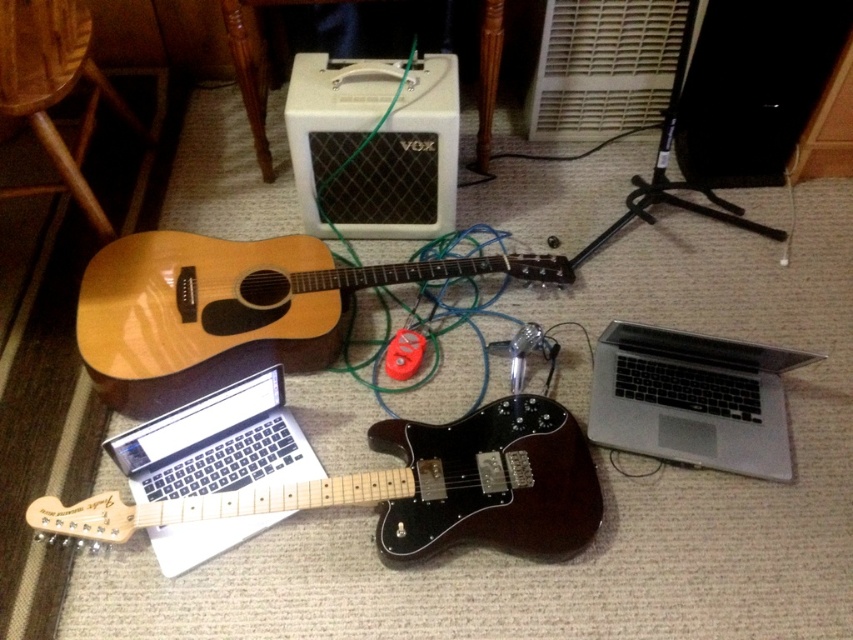
Question: Can you confirm if white mesh vox amplifier at center is positioned above silver metallic laptop at lower left?

Choices:
 (A) yes
 (B) no

Answer: (A)

Question: Does glossy wood guitar at center have a larger size compared to silver metallic laptop at lower right?

Choices:
 (A) no
 (B) yes

Answer: (B)

Question: Which of the following is the farthest from the observer?

Choices:
 (A) natural wood acoustic guitar at center
 (B) wooden stool at lower left
 (C) white mesh vox amplifier at center
 (D) silver metallic laptop at lower right

Answer: (C)

Question: Which point is closer to the camera?

Choices:
 (A) white mesh vox amplifier at center
 (B) natural wood acoustic guitar at center

Answer: (B)

Question: Can you confirm if glossy wood guitar at center is wider than natural wood acoustic guitar at center?

Choices:
 (A) yes
 (B) no

Answer: (A)

Question: Among these objects, which one is farthest from the camera?

Choices:
 (A) silver metallic laptop at lower left
 (B) white mesh vox amplifier at center

Answer: (B)